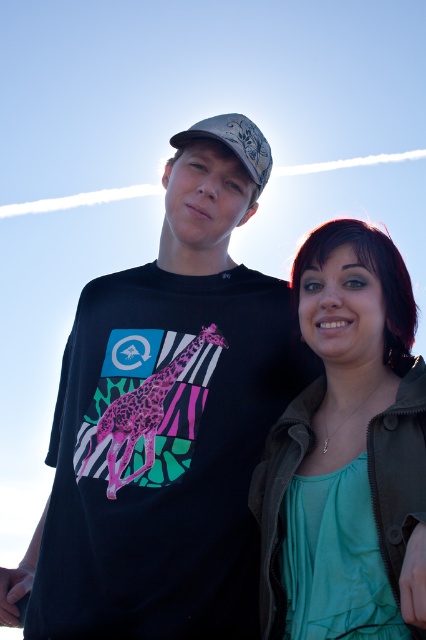
Does black matte t-shirt at center appear under white textured baseball cap at center?

Yes.

Who is taller, black matte t-shirt at center or white textured baseball cap at center?

black matte t-shirt at center is taller.

Who is more forward, [210,156] or [186,140]?

Positioned in front is point [186,140].

Image resolution: width=426 pixels, height=640 pixels. I want to click on black matte t-shirt at center, so click(x=169, y=419).

In the scene shown: Does teal fabric shirt at lower right lie in front of white textured baseball cap at center?

Yes, it is.

Does teal fabric shirt at lower right lie behind white textured baseball cap at center?

No.

This screenshot has height=640, width=426. What do you see at coordinates (348, 452) in the screenshot? I see `teal fabric shirt at lower right` at bounding box center [348, 452].

The width and height of the screenshot is (426, 640). What are the coordinates of `teal fabric shirt at lower right` in the screenshot? It's located at (348, 452).

Does pink leopard print giraffe at center have a smaller size compared to white textured baseball cap at center?

Actually, pink leopard print giraffe at center might be larger than white textured baseball cap at center.

Does pink leopard print giraffe at center lie in front of white textured baseball cap at center?

Yes, pink leopard print giraffe at center is in front of white textured baseball cap at center.

What do you see at coordinates (146, 406) in the screenshot? Image resolution: width=426 pixels, height=640 pixels. I see `pink leopard print giraffe at center` at bounding box center [146, 406].

This screenshot has height=640, width=426. I want to click on pink leopard print giraffe at center, so click(x=146, y=406).